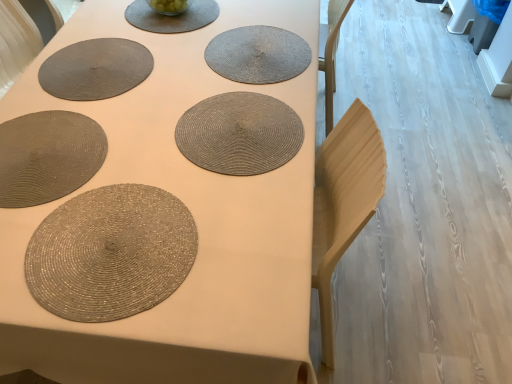
You are a GUI agent. You are given a task and a screenshot of the screen. Output one action in this format:
    pyautogui.click(x=<x>, y=<y>)
    Task: Click on the vacant space underneath shiny metallic placemat at bottom left, the 1th paper plate in the bottom-to-top sequence (from a real-world perspective)
    
    Given the screenshot: What is the action you would take?
    pyautogui.click(x=104, y=246)